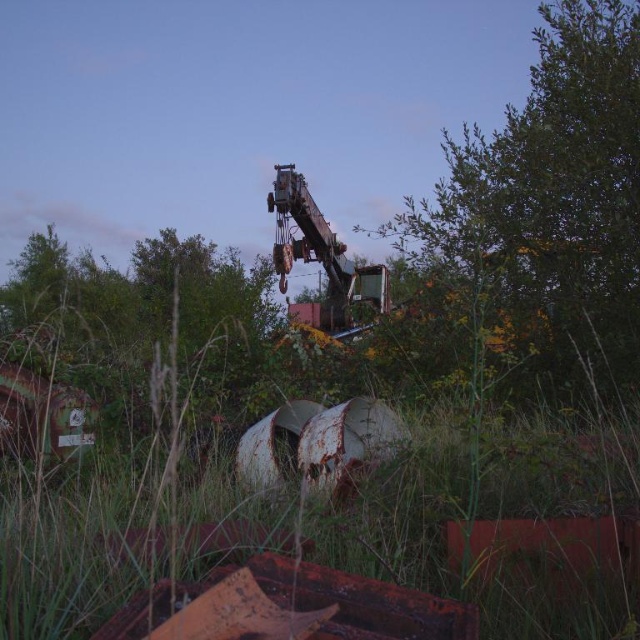
You are standing at the point labeled point (470,492). What is the nearest object to you?

→ The nearest object to you is the green grass at center because you are standing on it.